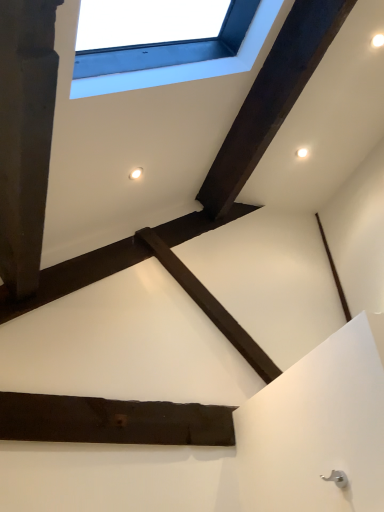
Question: Is white plastic window at upper center located within dark wood plank at center, which is the 1th plank from left to right?

Choices:
 (A) no
 (B) yes

Answer: (A)

Question: Is dark wood plank at center, placed as the 2th plank when sorted from top to bottom, closer to camera compared to white plastic window at upper center?

Choices:
 (A) no
 (B) yes

Answer: (A)

Question: Is dark wood plank at center, the first plank from the bottom, far away from white plastic window at upper center?

Choices:
 (A) no
 (B) yes

Answer: (B)

Question: Can you confirm if dark wood plank at center, which is the 1th plank from left to right, is bigger than white plastic window at upper center?

Choices:
 (A) no
 (B) yes

Answer: (A)

Question: From the image's perspective, is dark wood plank at center, which is the 1th plank from left to right, located beneath white plastic window at upper center?

Choices:
 (A) no
 (B) yes

Answer: (B)

Question: From the image's perspective, would you say dark wood plank at center, placed as the 2th plank when sorted from top to bottom, is positioned over white plastic window at upper center?

Choices:
 (A) no
 (B) yes

Answer: (A)

Question: Does dark brown wood at upper center, the second plank from the left, have a greater width compared to dark wood plank at center, which is counted as the second plank, starting from the right?

Choices:
 (A) no
 (B) yes

Answer: (B)

Question: Does dark brown wood at upper center, the 1th plank in the top-to-bottom sequence, appear on the left side of dark wood plank at center, which is the 1th plank from left to right?

Choices:
 (A) no
 (B) yes

Answer: (A)

Question: Is dark brown wood at upper center, the second plank from the left, outside dark wood plank at center, the first plank from the bottom?

Choices:
 (A) no
 (B) yes

Answer: (B)

Question: Is dark brown wood at upper center, acting as the 1th plank starting from the right, bigger than dark wood plank at center, placed as the 2th plank when sorted from top to bottom?

Choices:
 (A) no
 (B) yes

Answer: (B)

Question: Are dark brown wood at upper center, the second plank ordered from the bottom, and dark wood plank at center, which is the 1th plank from left to right, beside each other?

Choices:
 (A) yes
 (B) no

Answer: (B)

Question: Could you tell me if dark brown wood at upper center, the second plank from the left, is turned towards dark wood plank at center, which is counted as the second plank, starting from the right?

Choices:
 (A) no
 (B) yes

Answer: (A)

Question: Does white plastic window at upper center have a larger size compared to dark brown wood at upper center, the second plank ordered from the bottom?

Choices:
 (A) no
 (B) yes

Answer: (B)